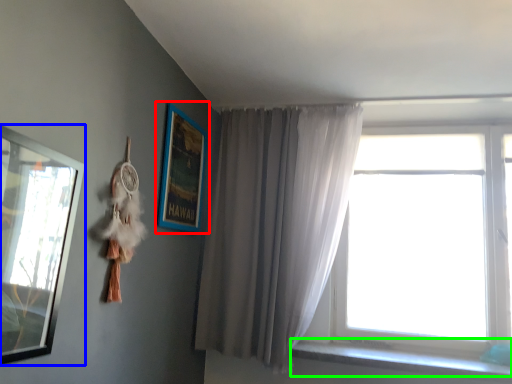
Question: Estimate the real-world distances between objects in this image. Which object is farther from picture frame (highlighted by a red box), picture frame (highlighted by a blue box) or window sill (highlighted by a green box)?

Choices:
 (A) picture frame
 (B) window sill

Answer: (B)